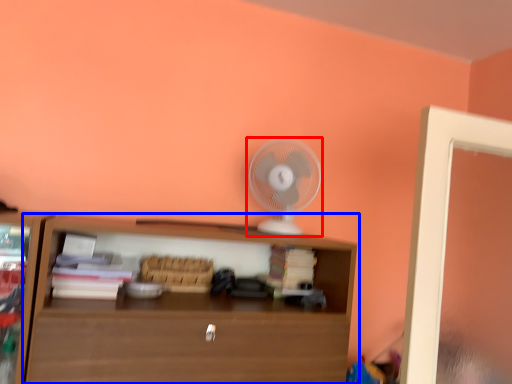
Question: Which object is closer to the camera taking this photo, mechanical fan (highlighted by a red box) or shelf (highlighted by a blue box)?

Choices:
 (A) mechanical fan
 (B) shelf

Answer: (B)